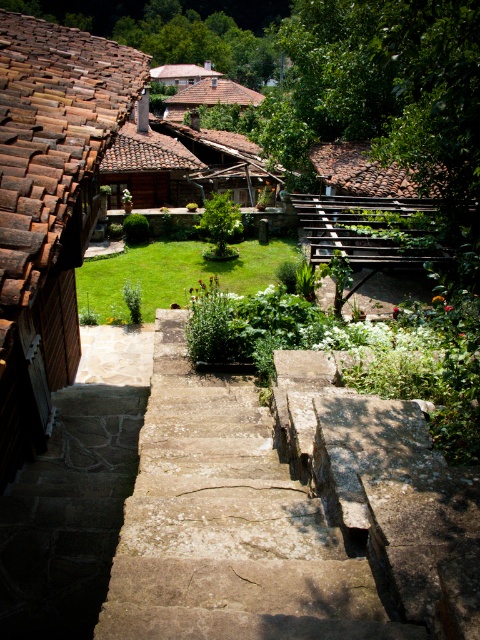
You are a drone operator tasked with capturing aerial footage of the rustic stone steps at center and the brown tile roof at upper center. The drone has a maximum flight range of 200 feet. Can the drone safely capture both locations in a single flight without needing to recharge?

The rustic stone steps at center and brown tile roof at upper center are 174.81 feet apart from each other. Since the drone can fly up to 200 feet, it can safely capture both locations in a single flight without needing to recharge.

You are standing at the top of the stone stairs at center and want to walk down to the garden bed with white blossoms near the center. Which direction should you head relative to the rustic stone steps at center?

You should head to the right relative to the rustic stone steps at center because the stone stairs at center, which you are on, is located to the right of the rustic stone steps at center.

You are standing at the top of the stone stairs at center. To your right, there is a wooden structure. Where is the wooden structure located relative to the point marked at coordinate (227, 525)?

The wooden structure is to the right of the point marked at coordinate (227, 525).